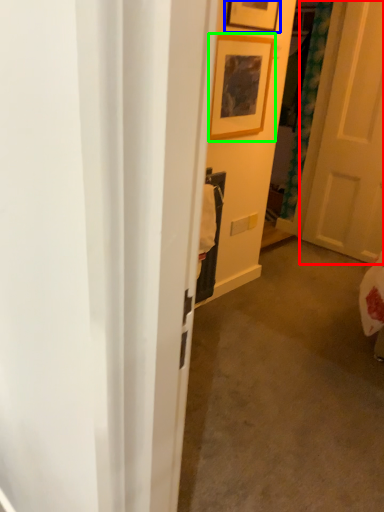
Question: Which object is positioned closest to door (highlighted by a red box)? Select from picture frame (highlighted by a blue box) and picture frame (highlighted by a green box).

Choices:
 (A) picture frame
 (B) picture frame

Answer: (B)